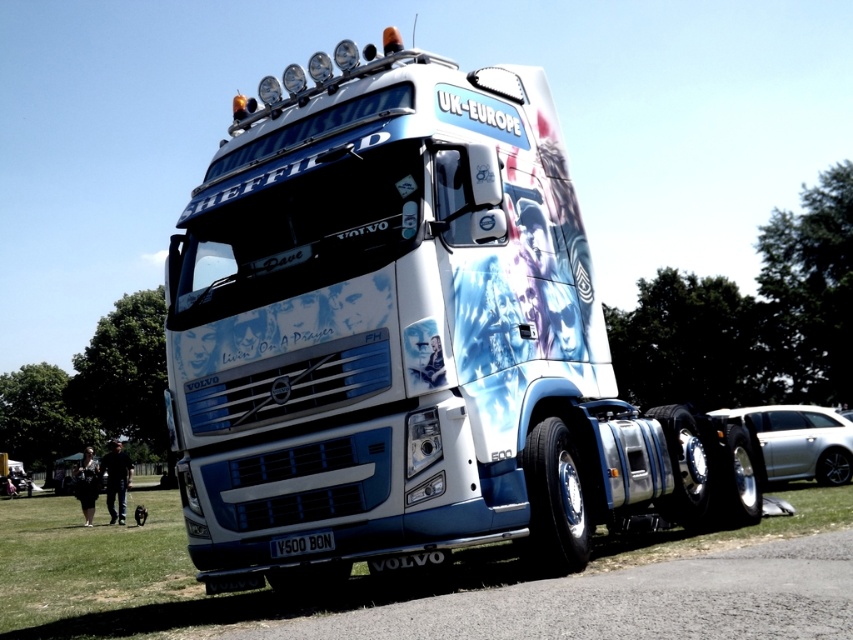
You are a photographer trying to capture the Volvo truck in the image. You need to decide whether to focus on the green grass at lower left or the black metallic license plate at bottom. Which object should you focus on if you want to capture the larger one in your shot?

The green grass at lower left is larger in size than the black metallic license plate at bottom, so you should focus on the green grass at lower left to capture the larger one in your shot.

You are standing in front of a Volvo truck and see two points marked on the truck. The first point is at coordinates point (479,419) and the second point is at point (287,545). Which point is closer to you?

Point (479,419) is closer to the viewer than point (287,545).

You are a photographer standing in front of the white glossy truck at center and the black metallic license plate at bottom. You want to take a photo that includes both objects in the frame. Which object should you position closer to the left side of the camera to ensure both are visible?

You should position the black metallic license plate at bottom closer to the left side of the camera because the white glossy truck at center is on the right side of it, so placing the license plate on the left will allow both to fit in the frame.